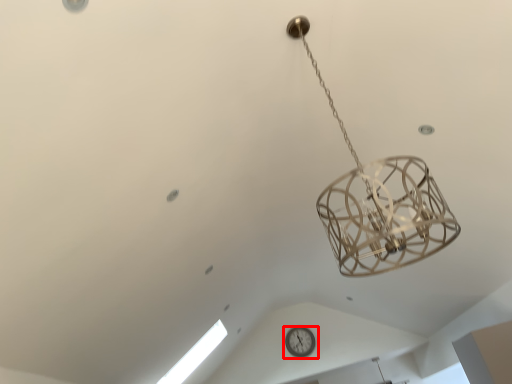
Question: From the image's perspective, considering the relative positions of wall clock (annotated by the red box) and window in the image provided, where is wall clock (annotated by the red box) located with respect to the staircase?

Choices:
 (A) below
 (B) above

Answer: (A)